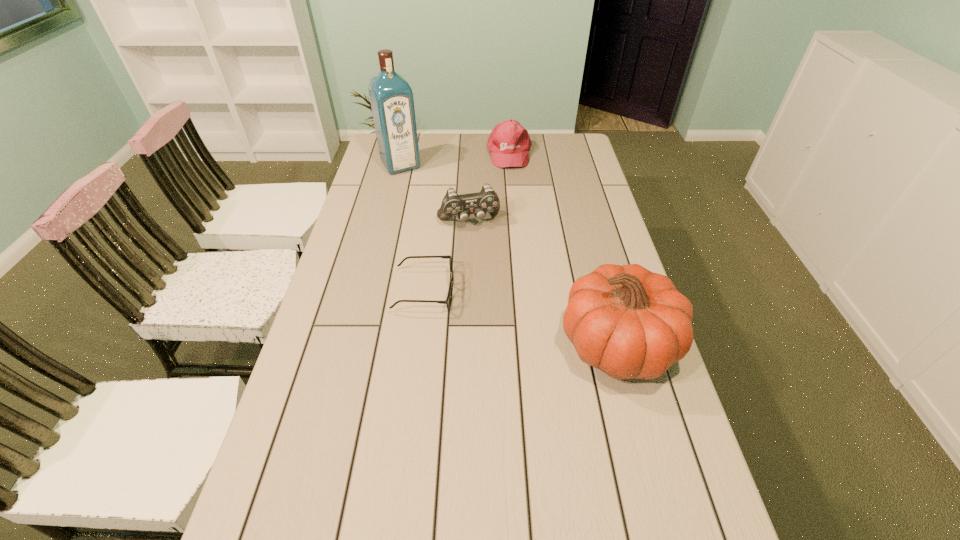
Find the location of a particular element. free space between the second tallest object and the baseball cap is located at coordinates (564, 249).

Find the location of `empty space that is in between the third farthest object and the tallest object`. empty space that is in between the third farthest object and the tallest object is located at coordinates (435, 193).

Image resolution: width=960 pixels, height=540 pixels. I want to click on free spot between the spectacles and the baseball cap, so click(467, 222).

Find the location of a particular element. object that ranks as the closest to the spectacles is located at coordinates (487, 200).

Locate an element on the screen. Image resolution: width=960 pixels, height=540 pixels. object that is the third closest to the spectacles is located at coordinates (391, 97).

Locate an element on the screen. This screenshot has height=540, width=960. free space that satisfies the following two spatial constraints: 1. on the front side of the control; 2. on the face of the pumpkin is located at coordinates (465, 345).

You are a GUI agent. You are given a task and a screenshot of the screen. Output one action in this format:
    pyautogui.click(x=<x>, y=<y>)
    Task: Click on the vacant region that satisfies the following two spatial constraints: 1. on the front side of the liquor; 2. on the face of the pumpkin
    
    Given the screenshot: What is the action you would take?
    pyautogui.click(x=357, y=345)

I want to click on free space that satisfies the following two spatial constraints: 1. on the front side of the control; 2. on the face of the fourth shortest object, so click(x=465, y=345).

Find the location of a particular element. free space that satisfies the following two spatial constraints: 1. on the front side of the pumpkin; 2. on the face of the third nearest object is located at coordinates (465, 345).